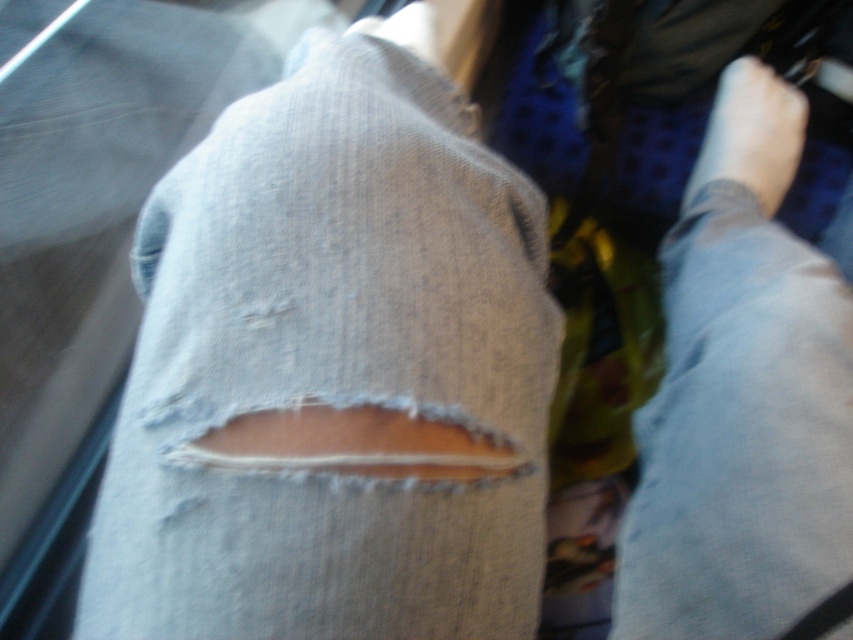
Between light blue denim jeans at lower right and white smooth foot at upper right, which one has more height?

light blue denim jeans at lower right

Between point (706, 332) and point (724, 145), which one is positioned in front?

Point (706, 332) is more forward.

Where is `light blue denim jeans at lower right`? This screenshot has height=640, width=853. light blue denim jeans at lower right is located at coordinates (741, 429).